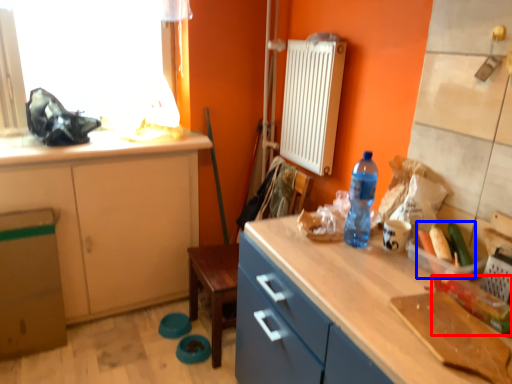
Question: Which object appears farthest to the camera in this image, vegetable (highlighted by a red box) or food (highlighted by a blue box)?

Choices:
 (A) vegetable
 (B) food

Answer: (B)